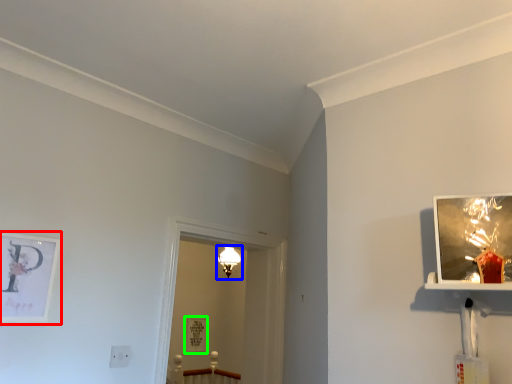
Question: Based on their relative distances, which object is farther from picture frame (highlighted by a red box)? Choose from light fixture (highlighted by a blue box) and picture frame (highlighted by a green box).

Choices:
 (A) light fixture
 (B) picture frame

Answer: (B)